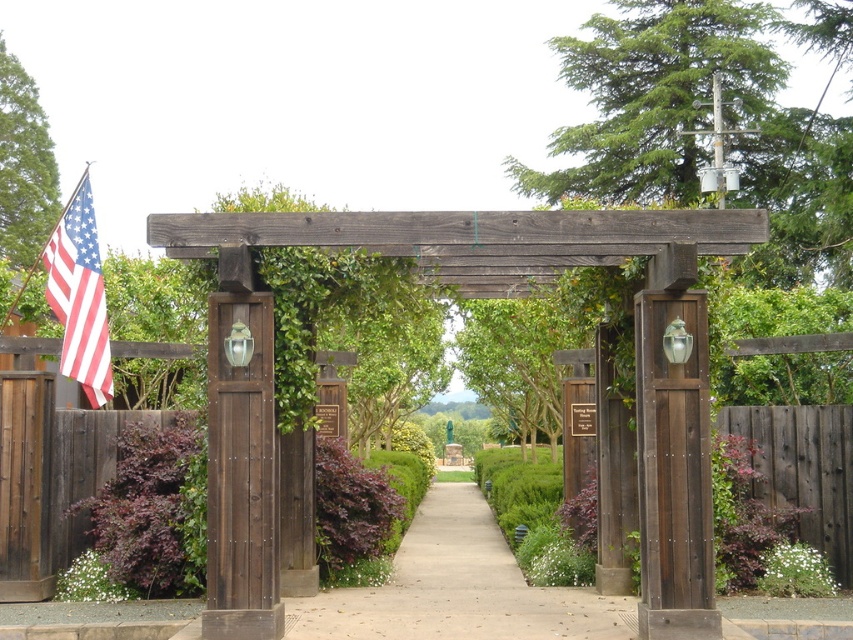
Who is more forward, (236,435) or (33,566)?

Positioned in front is point (236,435).

Does brown wooden post at left have a lesser width compared to wooden gate at left?

Incorrect, brown wooden post at left's width is not less than wooden gate at left's.

Measure the distance between brown wooden post at left and camera.

brown wooden post at left is 8.27 meters from camera.

In order to click on brown wooden post at left in this screenshot , I will do `click(241, 472)`.

Can you confirm if brown wooden post at left is positioned to the right of metallic flagpole at upper left?

Indeed, brown wooden post at left is positioned on the right side of metallic flagpole at upper left.

Can you confirm if brown wooden post at left is thinner than metallic flagpole at upper left?

Correct, brown wooden post at left's width is less than metallic flagpole at upper left's.

Who is more forward, (238, 586) or (30, 272)?

Point (238, 586) is more forward.

This screenshot has height=640, width=853. I want to click on brown wooden post at left, so click(241, 472).

Which of these two, dark brown wood pergola at center or wooden gate at left, stands shorter?

Standing shorter between the two is dark brown wood pergola at center.

What do you see at coordinates (434, 275) in the screenshot? Image resolution: width=853 pixels, height=640 pixels. I see `dark brown wood pergola at center` at bounding box center [434, 275].

The height and width of the screenshot is (640, 853). I want to click on dark brown wood pergola at center, so click(x=434, y=275).